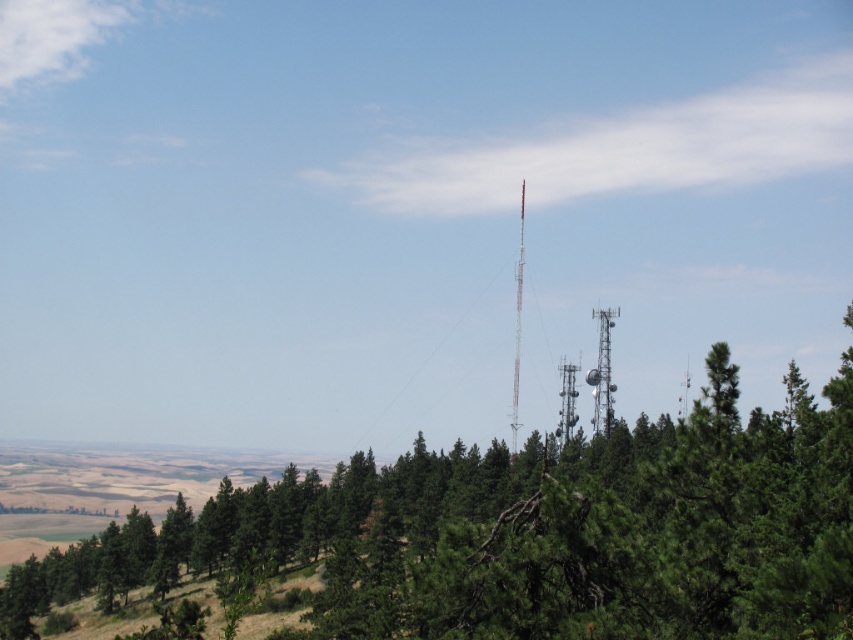
You are standing at the base of the tallest communication tower in the image. Looking out, you notice a point marked at coordinates [523,534]. What object is located at that point?

The point at [523,534] indicates a green textured tree at center.

You are standing at the base of the communication towers and want to determine which of the two points, point (616, 307) or point (572, 397), is nearer to you. Based on the scene, which point is closer?

Point (616, 307) is closer to the viewer than point (572, 397).